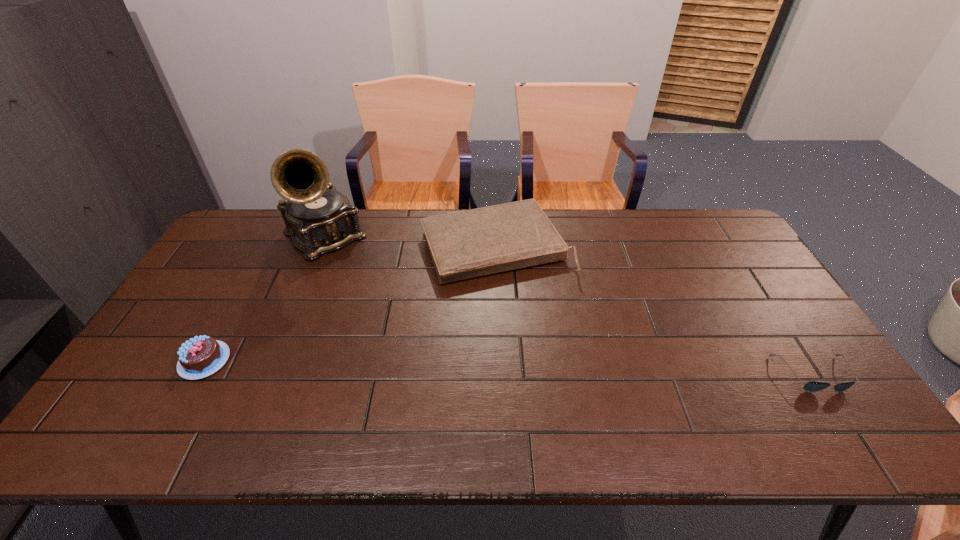
Where is `vacant space on the desktop that is between the chocolate cake and the rightmost object and is positioned on the spine side of the paperback book`? This screenshot has width=960, height=540. vacant space on the desktop that is between the chocolate cake and the rightmost object and is positioned on the spine side of the paperback book is located at coordinates (559, 369).

Find the location of a particular element. vacant space on the desktop that is between the chocolate cake and the shortest object and is positioned on the horn of the tallest object is located at coordinates (442, 366).